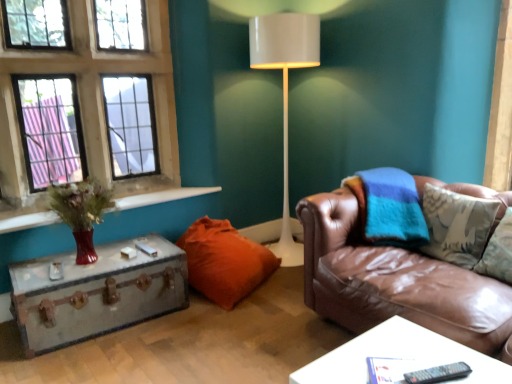
At what (x,y) coordinates should I click in order to perform the action: click on vacant region in front of orange fabric pillow at lower center. Please return your answer as a coordinate pair (x, y). The image size is (512, 384). Looking at the image, I should click on (225, 330).